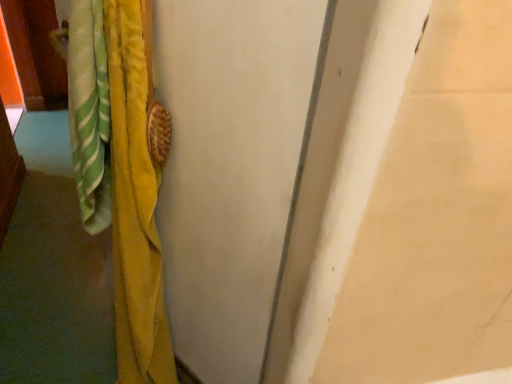
Locate an element on the screen. The image size is (512, 384). wooden door at center is located at coordinates (230, 168).

The width and height of the screenshot is (512, 384). Describe the element at coordinates (230, 168) in the screenshot. I see `wooden door at center` at that location.

From the picture: Measure the distance between point (294, 187) and camera.

The depth of point (294, 187) is 26.61 inches.

This screenshot has height=384, width=512. I want to click on wooden door at center, so click(x=230, y=168).